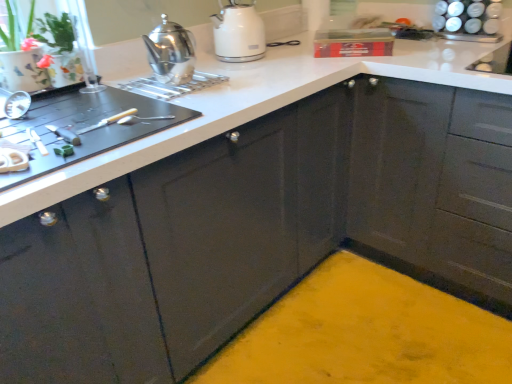
Identify the location of unoccupied region to the right of white glossy kettle at upper center, which is the first kitchen appliance in back-to-front order. [x=296, y=57].